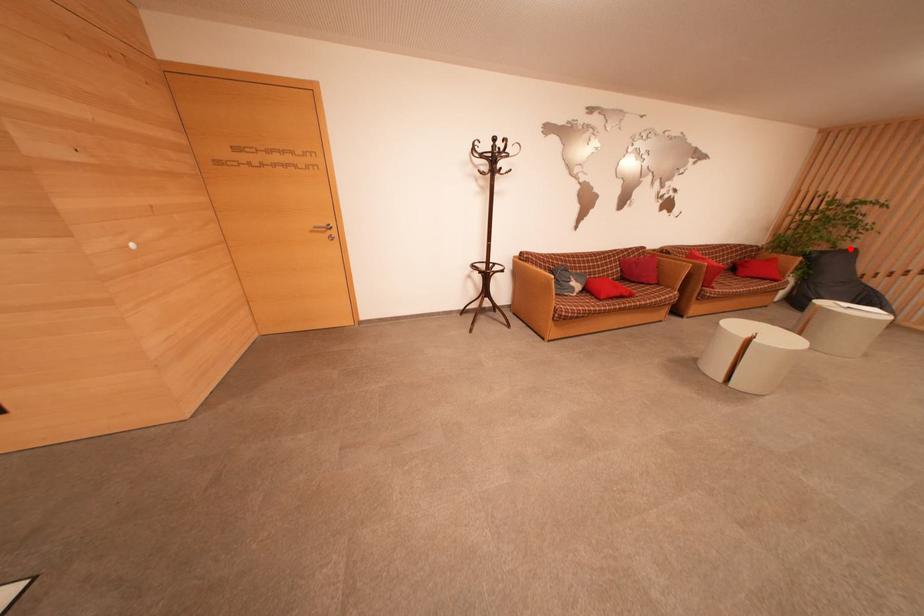
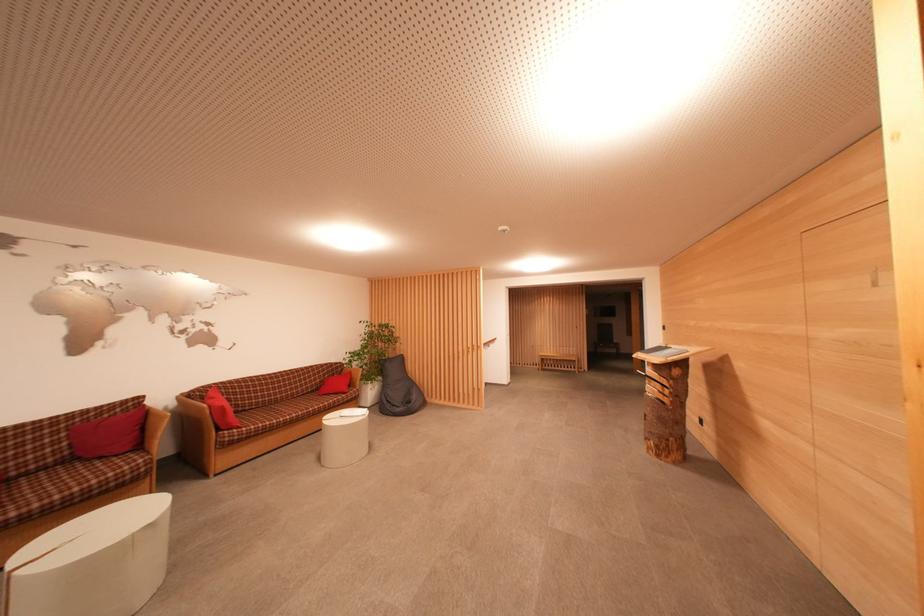
Question: I am providing you with two images of the same scene from different viewpoints. Given a red point in image1, look at the same physical point in image2. Is it:

Choices:
 (A) Closer to the viewpoint
 (B) Farther from the viewpoint

Answer: (A)